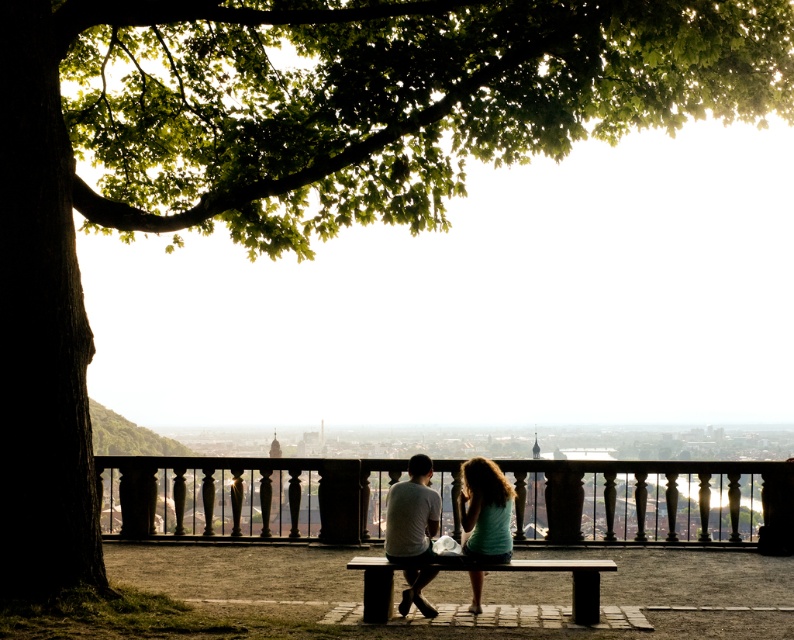
Is point (488, 556) farther from viewer compared to point (426, 512)?

No.

Can you confirm if matte white shirt at center is thinner than gray cotton t-shirt at center?

Yes.

Where is `matte white shirt at center`? This screenshot has height=640, width=794. matte white shirt at center is located at coordinates (484, 509).

Can you confirm if wooden bench at center is positioned above gray cotton t-shirt at center?

No.

Who is shorter, wooden bench at center or gray cotton t-shirt at center?

wooden bench at center is shorter.

Is point (565, 563) positioned behind point (426, 532)?

No, (565, 563) is closer to viewer.

At what (x,y) coordinates should I click in order to perform the action: click on wooden bench at center. Please return your answer as a coordinate pair (x, y). This screenshot has height=640, width=794. Looking at the image, I should click on (480, 570).

Does gray cotton t-shirt at center appear under light blue fabric skirt at center?

Incorrect, gray cotton t-shirt at center is not positioned below light blue fabric skirt at center.

Is point (434, 499) closer to camera compared to point (478, 508)?

No, it is not.

Image resolution: width=794 pixels, height=640 pixels. Describe the element at coordinates (411, 513) in the screenshot. I see `gray cotton t-shirt at center` at that location.

This screenshot has width=794, height=640. I want to click on gray cotton t-shirt at center, so click(x=411, y=513).